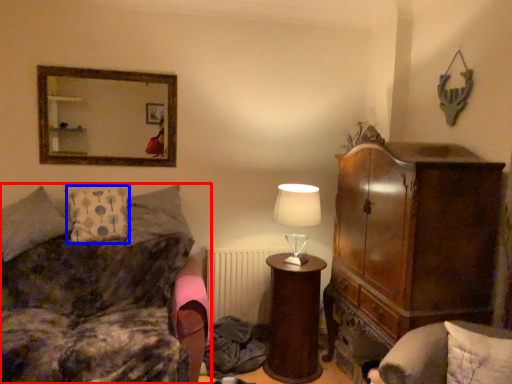
Question: Which object appears closest to the camera in this image, studio couch (highlighted by a red box) or pillow (highlighted by a blue box)?

Choices:
 (A) studio couch
 (B) pillow

Answer: (A)